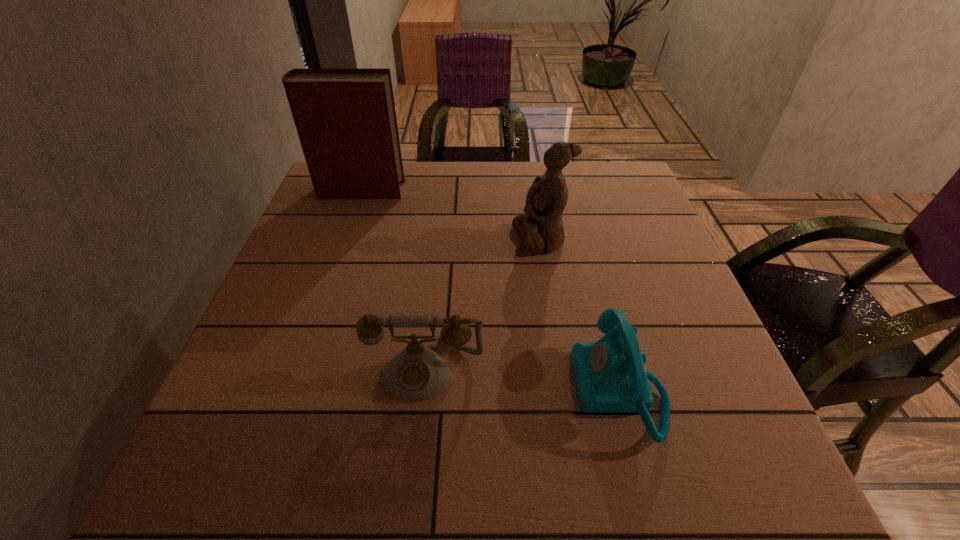
Find the location of a particular element. The height and width of the screenshot is (540, 960). free space at the far edge of the desktop is located at coordinates (431, 165).

Identify the location of vacant region at the left edge of the desktop. (324, 309).

In the image, there is a desktop. At what (x,y) coordinates should I click in order to perform the action: click on blank space at the right edge. Please return your answer as a coordinate pair (x, y). The height and width of the screenshot is (540, 960). Looking at the image, I should click on (689, 397).

Identify the location of vacant space at the near left corner of the desktop. (177, 492).

The width and height of the screenshot is (960, 540). What are the coordinates of `vacant space at the far right corner` in the screenshot? It's located at (592, 191).

Locate an element on the screen. Image resolution: width=960 pixels, height=540 pixels. empty space that is in between the right telephone and the second object from left to right is located at coordinates (522, 381).

Locate an element on the screen. The height and width of the screenshot is (540, 960). free space between the farthest object and the right telephone is located at coordinates (490, 290).

The height and width of the screenshot is (540, 960). In order to click on free space between the right telephone and the left telephone in this screenshot , I will do `click(522, 381)`.

Locate an element on the screen. empty space that is in between the right telephone and the left telephone is located at coordinates (522, 381).

Identify the location of free space between the third nearest object and the right telephone. This screenshot has width=960, height=540. (580, 314).